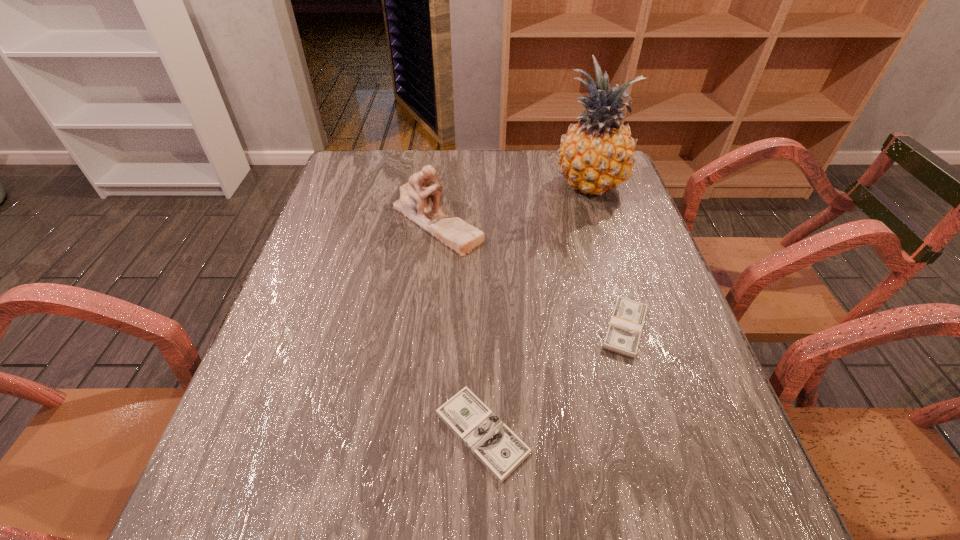
The width and height of the screenshot is (960, 540). Find the location of `free space between the farther dollar and the figurine`. free space between the farther dollar and the figurine is located at coordinates (531, 275).

Where is `empty location between the pineapple and the right dollar`? This screenshot has width=960, height=540. empty location between the pineapple and the right dollar is located at coordinates click(x=608, y=257).

At what (x,y) coordinates should I click in order to perform the action: click on vacant space that is in between the left dollar and the right dollar. Please return your answer as a coordinate pair (x, y). This screenshot has width=960, height=540. Looking at the image, I should click on (554, 380).

Find the location of a particular element. vacant space in between the nearer dollar and the figurine is located at coordinates (x=459, y=327).

Locate an element on the screen. This screenshot has width=960, height=540. free space between the third shortest object and the tallest object is located at coordinates (514, 204).

This screenshot has height=540, width=960. What are the coordinates of `free spot between the third farthest object and the left dollar` in the screenshot? It's located at (554, 380).

Where is `unoccupied area between the farther dollar and the pineapple`? unoccupied area between the farther dollar and the pineapple is located at coordinates (608, 257).

Identify which object is the closest to the figurine. Please provide its 2D coordinates. Your answer should be formatted as a tuple, i.e. [(x, y)], where the tuple contains the x and y coordinates of a point satisfying the conditions above.

[(596, 155)]

At what (x,y) coordinates should I click in order to perform the action: click on object that is the second nearest to the third shortest object. Please return your answer as a coordinate pair (x, y). The image size is (960, 540). Looking at the image, I should click on (625, 327).

Identify the location of blank area in the image that satisfies the following two spatial constraints: 1. on the front-facing side of the figurine; 2. on the right side of the nearest object. (413, 433).